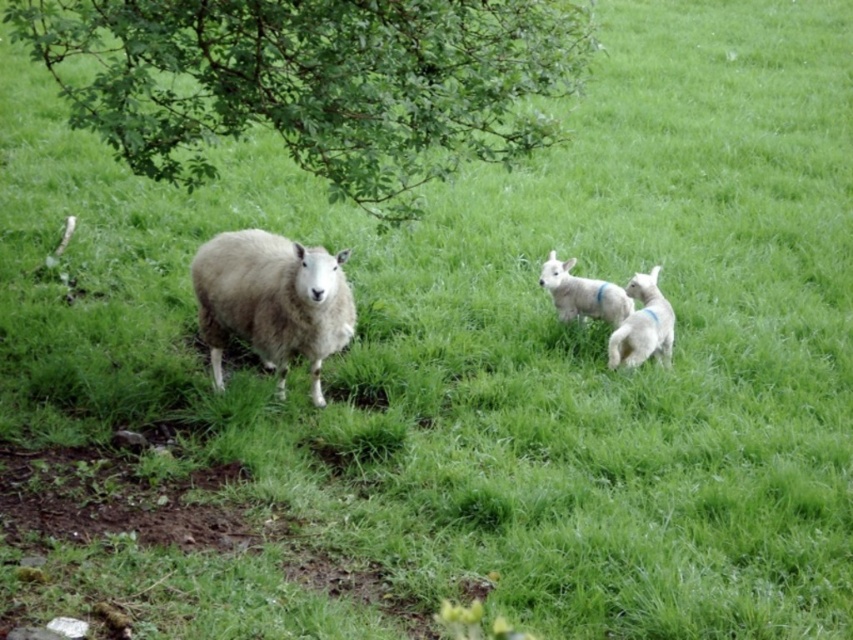
Question: Which point is farther from the camera taking this photo?

Choices:
 (A) (601, 296)
 (B) (621, 353)

Answer: (A)

Question: Which object is farther from the camera taking this photo?

Choices:
 (A) white woolen lamb at right
 (B) green leafy tree at upper left
 (C) white woolen lamb at center-right

Answer: (C)

Question: Which object is the closest to the green leafy tree at upper left?

Choices:
 (A) white woolly sheep at center
 (B) white woolen lamb at right

Answer: (A)

Question: Can you confirm if green leafy tree at upper left is wider than white woolen lamb at right?

Choices:
 (A) yes
 (B) no

Answer: (A)

Question: Can you confirm if white woolly sheep at center is thinner than white woolen lamb at right?

Choices:
 (A) no
 (B) yes

Answer: (A)

Question: Is white woolly sheep at center closer to the viewer compared to white woolen lamb at center-right?

Choices:
 (A) yes
 (B) no

Answer: (A)